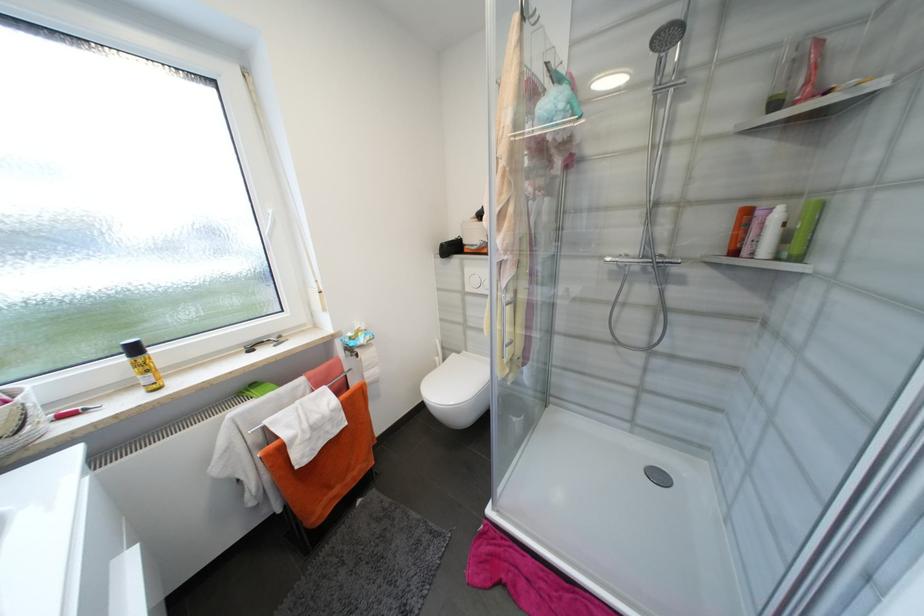
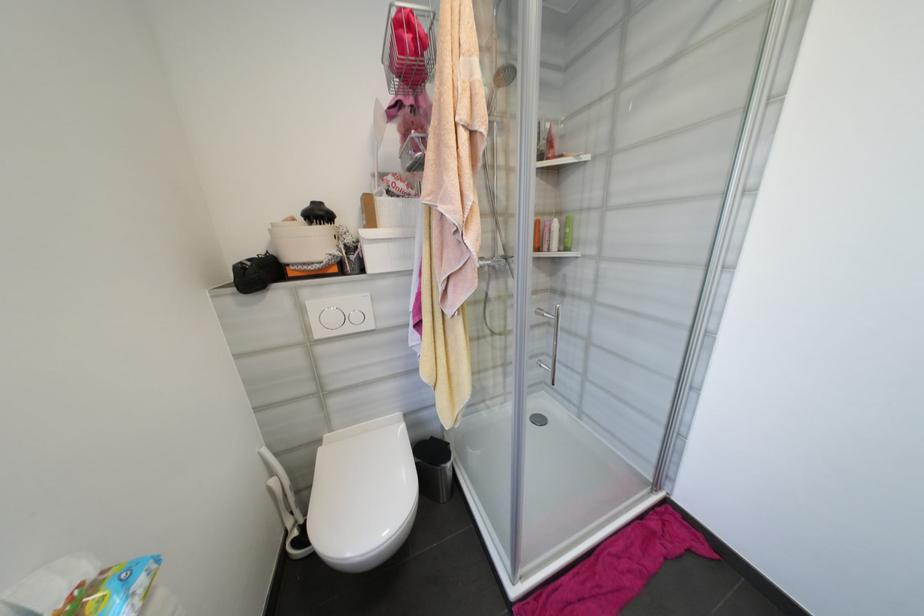
Locate, in the second image, the point that corresponds to [465,354] in the first image.

(325, 443)